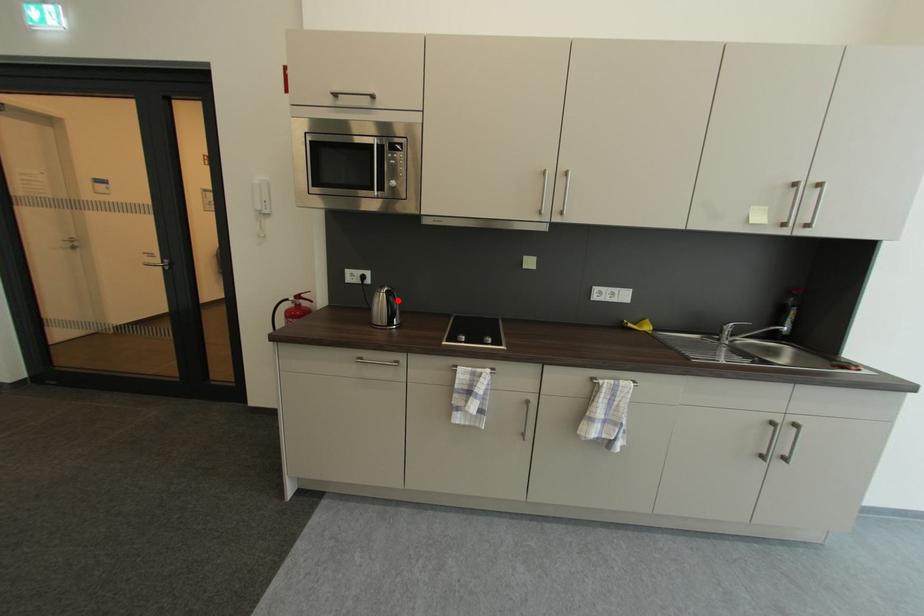
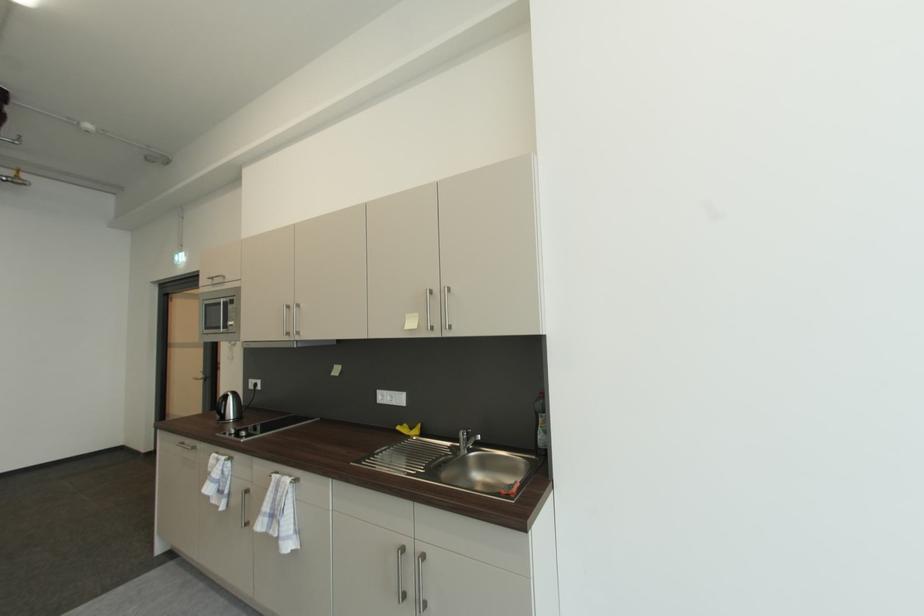
The point at the highlighted location is marked in the first image. Where is the corresponding point in the second image?

(227, 402)